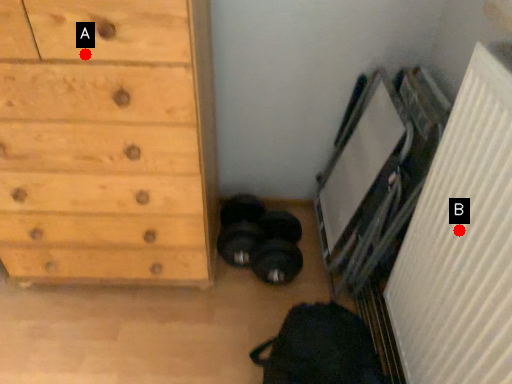
Question: Two points are circled on the image, labeled by A and B beside each circle. Which of the following is the farthest from the observer?

Choices:
 (A) A is further
 (B) B is further

Answer: (A)